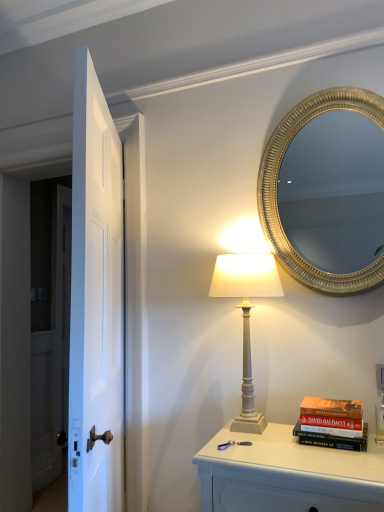
This screenshot has width=384, height=512. Identify the location of empty space that is ontop of white painted wood nightstand at lower right (from a real-world perspective). (295, 450).